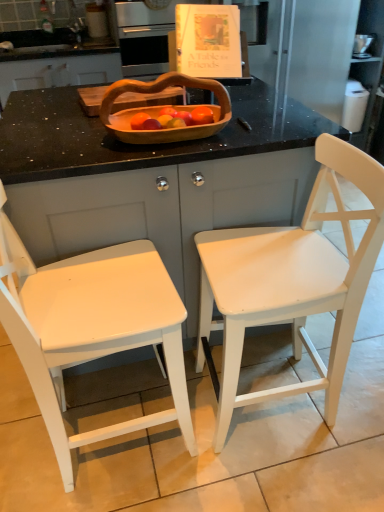
You are a GUI agent. You are given a task and a screenshot of the screen. Output one action in this format:
    pyautogui.click(x=<x>, y=<y>)
    Task: Click on the vacant region to the left of wooden cutting board at upper center
    The image size is (384, 512).
    Given the screenshot: What is the action you would take?
    pyautogui.click(x=50, y=112)